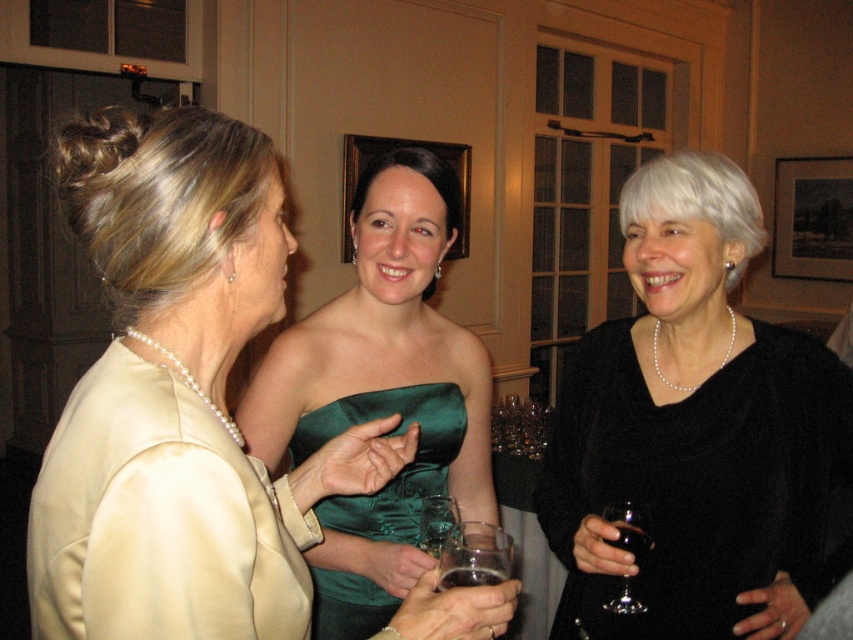
Question: Among these points, which one is nearest to the camera?

Choices:
 (A) (648, 548)
 (B) (444, 563)

Answer: (B)

Question: Where is black matte dress at right located in relation to clear glass at center in the image?

Choices:
 (A) right
 (B) left

Answer: (A)

Question: Among these objects, which one is nearest to the camera?

Choices:
 (A) satin green dress at center
 (B) green satin dress at center

Answer: (A)

Question: In this image, where is satin green dress at center located relative to transparent glass wine glass at lower right?

Choices:
 (A) left
 (B) right

Answer: (A)

Question: Which of these objects is positioned farthest from the green satin dress at center?

Choices:
 (A) clear glass at center
 (B) transparent glass at center

Answer: (A)

Question: Is transparent glass wine glass at lower right to the right of translucent glass at lower right from the viewer's perspective?

Choices:
 (A) yes
 (B) no

Answer: (B)